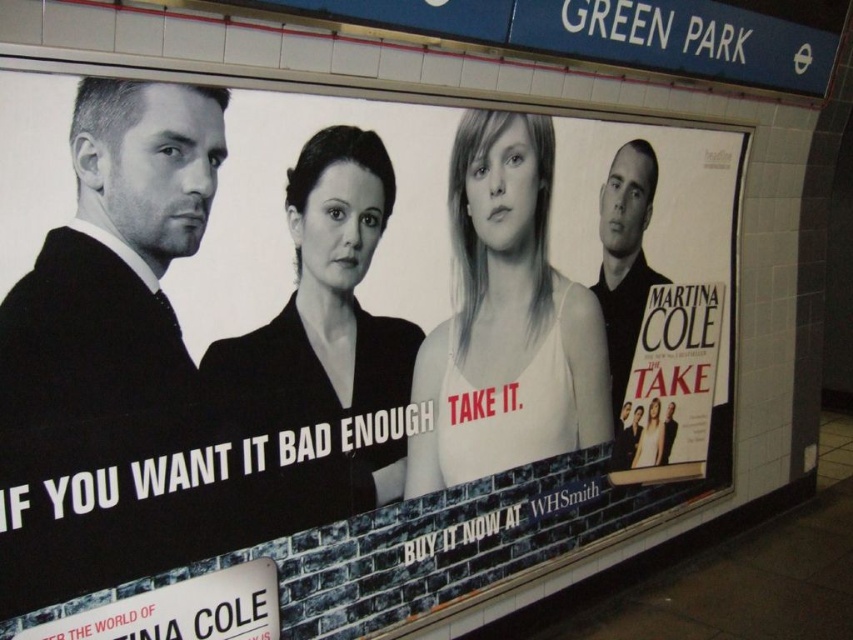
Is white matte tank top at center to the left of black matte shirt at right from the viewer's perspective?

Yes, white matte tank top at center is to the left of black matte shirt at right.

Between white matte tank top at center and black matte shirt at right, which one has less height?

Standing shorter between the two is black matte shirt at right.

Does point (494, 307) lie behind point (618, 253)?

No.

This screenshot has height=640, width=853. I want to click on white matte tank top at center, so click(x=505, y=321).

Is white matte tank top at center taller than smooth white tank top at center?

Correct, white matte tank top at center is much taller as smooth white tank top at center.

Between white matte tank top at center and smooth white tank top at center, which one appears on the left side from the viewer's perspective?

Positioned to the left is white matte tank top at center.

Where is `white matte tank top at center`? white matte tank top at center is located at coordinates (505, 321).

Is point (613, 324) positioned behind point (659, 444)?

No, it is in front of (659, 444).

Does point (637, 186) come farther from viewer compared to point (657, 426)?

No, it is not.

Locate an element on the screen. black matte shirt at right is located at coordinates (625, 257).